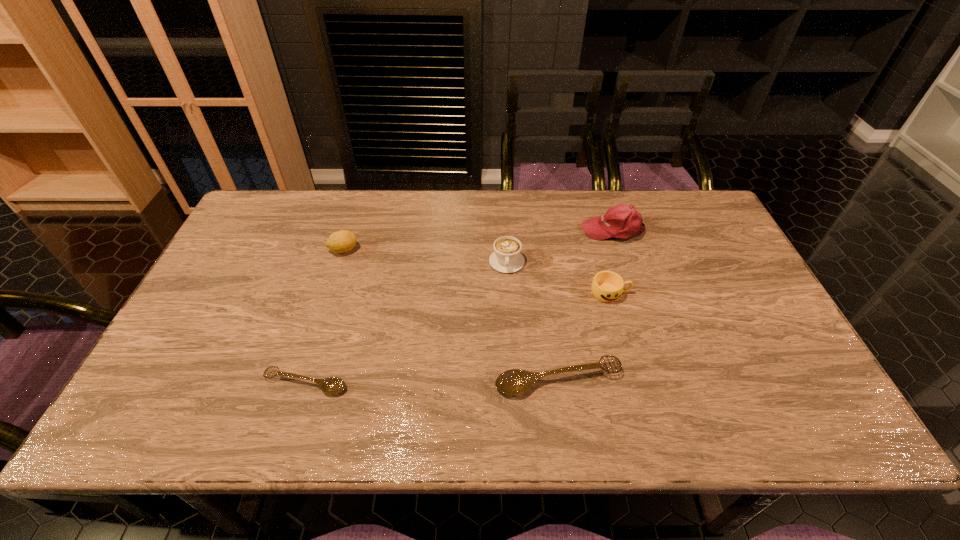
Identify the location of free space located 0.350m on the right of the right ladle. (773, 380).

Identify the location of vacant region located at the stem end of the lemon. The image size is (960, 540). (385, 250).

Locate an element on the screen. The width and height of the screenshot is (960, 540). vacant space located at the front of the tallest object with the brim is located at coordinates (512, 230).

The image size is (960, 540). Identify the location of vacant space situated at the front of the tallest object with the brim. (455, 230).

The image size is (960, 540). In order to click on vacant space located at the front of the tallest object with the brim in this screenshot , I will do `click(506, 230)`.

The height and width of the screenshot is (540, 960). I want to click on free space located to the right of the cappuccino's handle, so click(x=515, y=388).

Locate an element on the screen. The width and height of the screenshot is (960, 540). vacant space located on the right of the fourth farthest object is located at coordinates (739, 293).

Identify the location of object present at the far edge. (622, 221).

At what (x,y) coordinates should I click in order to perform the action: click on vacant space at the far edge. Please return your answer as a coordinate pair (x, y). The height and width of the screenshot is (540, 960). Looking at the image, I should click on [x=453, y=210].

Image resolution: width=960 pixels, height=540 pixels. In the image, there is a desktop. What are the coordinates of `free region at the near edge` in the screenshot? It's located at (428, 377).